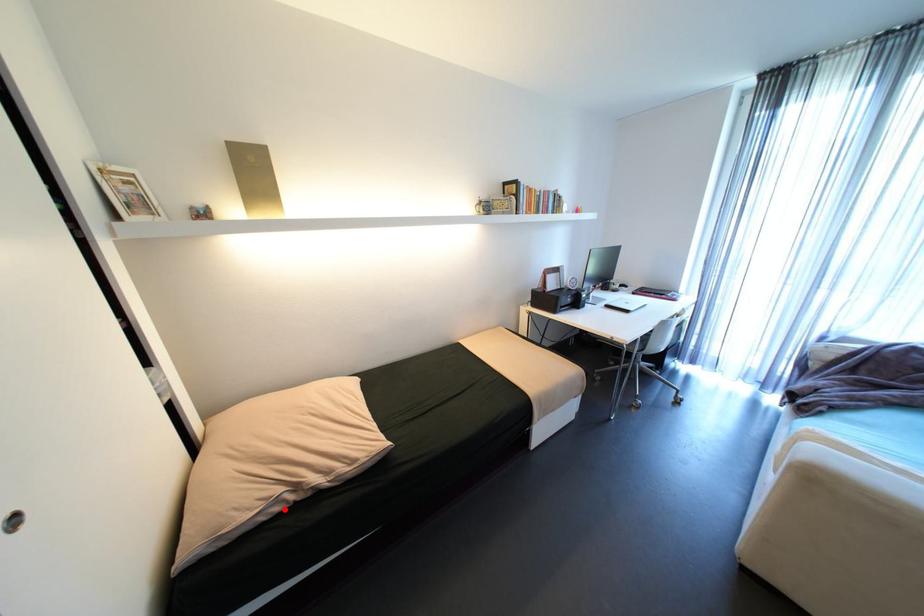
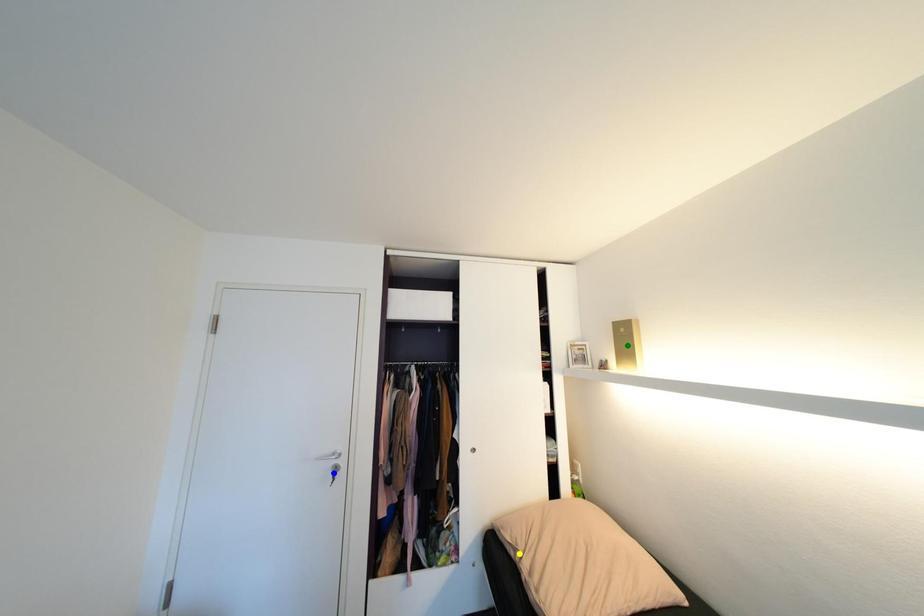
Question: I am providing you with two images of the same scene from different viewpoints. A red point is marked on the first image. You are given multiple points on the second image. Which mark in image 2 goes with the point in image 1?

Choices:
 (A) blue point
 (B) yellow point
 (C) green point

Answer: (B)